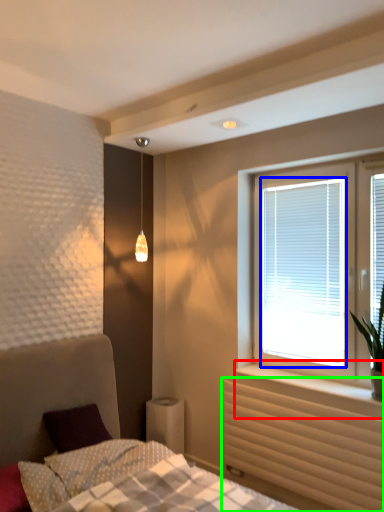
Question: Which object is positioned closest to window sill (highlighted by a red box)? Select from window screen (highlighted by a blue box) and radiator (highlighted by a green box).

Choices:
 (A) window screen
 (B) radiator

Answer: (B)